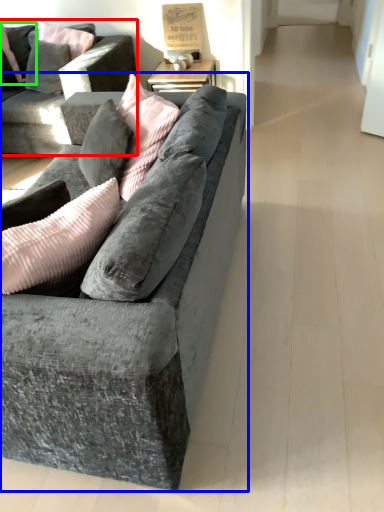
Question: Which object is the closest to the studio couch (highlighted by a red box)? Choose among these: studio couch (highlighted by a blue box) or pillow (highlighted by a green box).

Choices:
 (A) studio couch
 (B) pillow

Answer: (B)